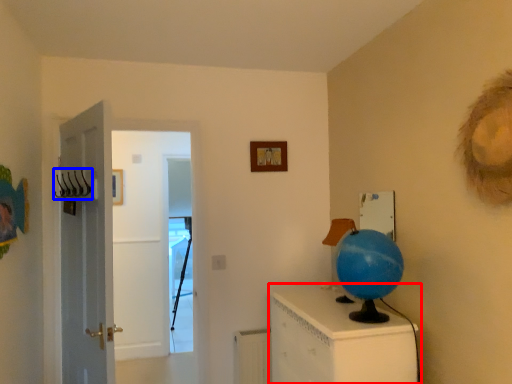
Question: Among these objects, which one is farthest to the camera, furniture (highlighted by a red box) or hanger (highlighted by a blue box)?

Choices:
 (A) furniture
 (B) hanger

Answer: (B)